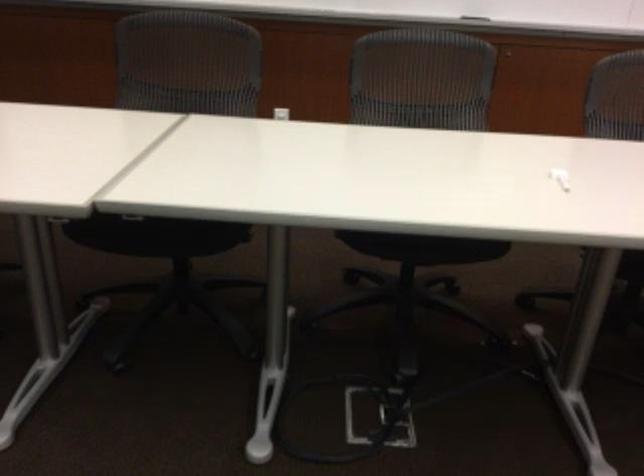
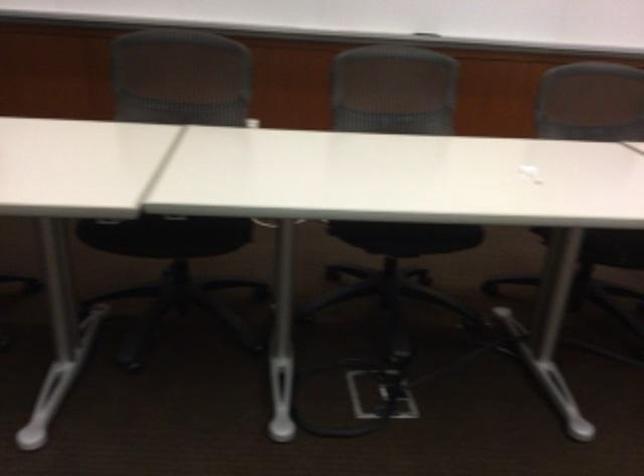
Find the pixel in the second image that matches point 417,244 in the first image.

(406, 237)